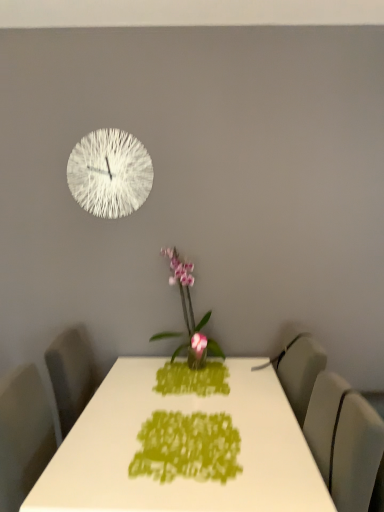
Where is `free spot above white glossy table at center (from a real-world perspective)`? This screenshot has height=512, width=384. free spot above white glossy table at center (from a real-world perspective) is located at coordinates (171, 399).